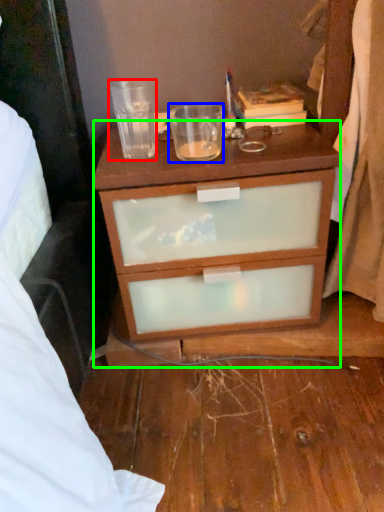
Question: Which object is the farthest from coffee cup (highlighted by a red box)? Choose among these: coffee cup (highlighted by a blue box) or desk (highlighted by a green box).

Choices:
 (A) coffee cup
 (B) desk

Answer: (B)